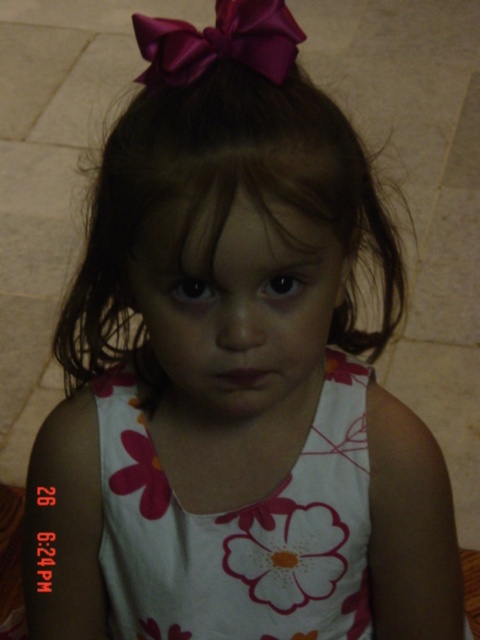
Is point (248, 227) positioned behind point (219, 56)?

No.

Can you confirm if smooth skin face at center is positioned to the left of satin purple bow at upper center?

In fact, smooth skin face at center is to the right of satin purple bow at upper center.

Locate an element on the screen. This screenshot has height=640, width=480. smooth skin face at center is located at coordinates (236, 305).

Looking at this image, is white floral dress at center bigger than satin purple bow at upper center?

Yes, white floral dress at center is bigger than satin purple bow at upper center.

Does white floral dress at center lie behind satin purple bow at upper center?

Yes, white floral dress at center is further from the viewer.

This screenshot has height=640, width=480. I want to click on white floral dress at center, so click(x=239, y=529).

Based on the photo, which is more to the right, dark brown silky hair at center or smooth skin face at center?

dark brown silky hair at center

Looking at this image, does dark brown silky hair at center have a larger size compared to smooth skin face at center?

Indeed, dark brown silky hair at center has a larger size compared to smooth skin face at center.

Does point (180, 120) come farther from viewer compared to point (180, 406)?

No, (180, 120) is closer to viewer.

You are a GUI agent. You are given a task and a screenshot of the screen. Output one action in this format:
    pyautogui.click(x=<x>, y=<y>)
    Task: Click on the dark brown silky hair at center
    This screenshot has height=640, width=480.
    Given the screenshot: What is the action you would take?
    pyautogui.click(x=220, y=204)